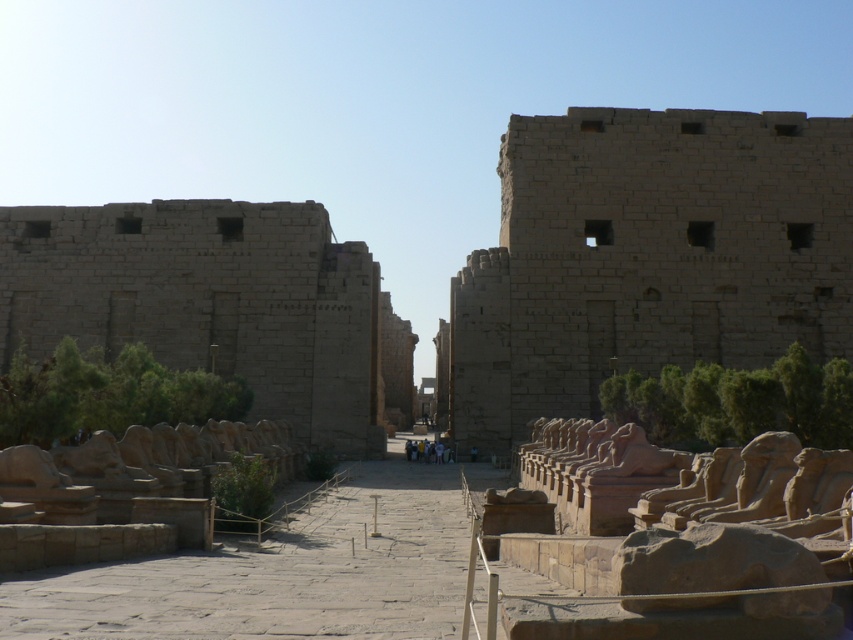
You are standing at the entrance of the ancient Egyptian temple complex. You see the brown stone wall at center. Can you determine its location relative to the entrance?

The brown stone wall at center is located at point (647, 257) relative to the entrance, which means it is positioned approximately 40.3 percent from the left edge and 76 percent from the top edge of the scene.

You are an archaeologist standing at the entrance of the temple complex. You notice the brown stone wall at center and the beige stone ruins at left. Which structure is nearer to you?

The brown stone wall at center is closer to the viewer than the beige stone ruins at left, so the brown stone wall at center is nearer to you.

You are an archaeologist standing in front of the temple complex. You need to determine which structure is narrower between the brown stone wall at center and the beige stone ruins at left. Which one is narrower?

The brown stone wall at center is narrower than the beige stone ruins at left because the brown stone wall at center has a lesser width compared to beige stone ruins at left.